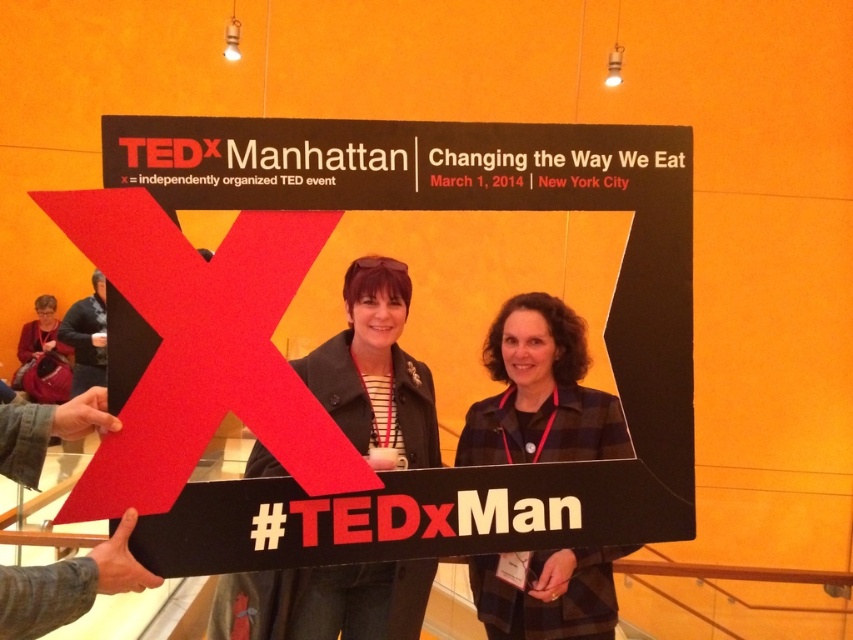
You are standing at the TEDxManhattan event and notice two points marked on the ground in front of the sign. The first point is labeled as point (541, 316), and the second is point (68, 358). Which point is closer to you as you stand facing the sign?

Point (541, 316) is closer to the camera than point (68, 358), so the first point is closer to you as you stand facing the sign.

You are attending the TEDxManhattan event and notice two attendees wearing the plaid fabric jacket at center and the dark gray sweater at left. Which clothing item is located lower in the image?

The plaid fabric jacket at center is positioned under the dark gray sweater at left, so it is located lower in the image.

Consider the image. You are a photographer at the TEDxManhattan event. You need to capture a clear photo of the dark gray sweater at left and the plaid fabric jacket at center. Which one should you focus on first to ensure both are in focus?

The plaid fabric jacket at center is in front of the dark gray sweater at left, so you should focus on the plaid fabric jacket at center first to ensure both are in focus.